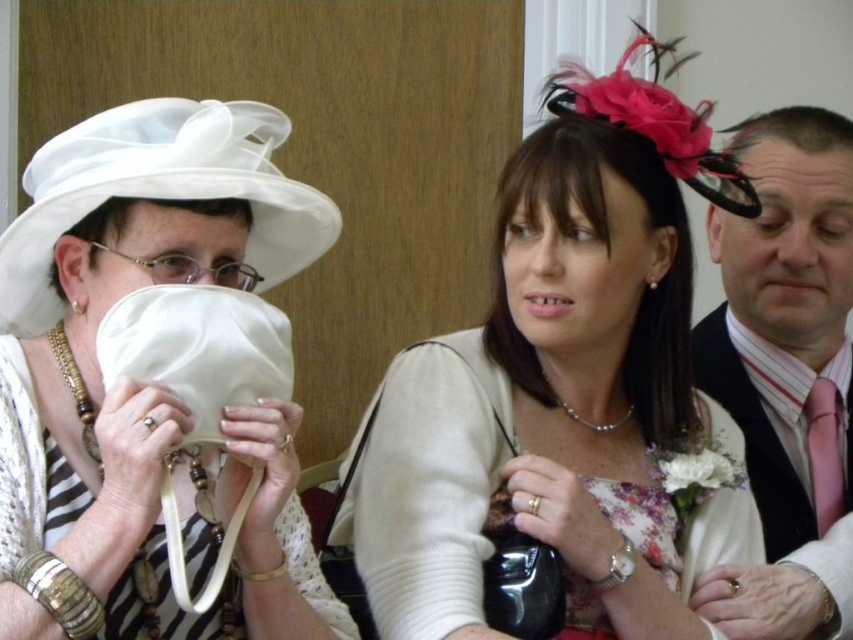
Question: Does matte white hat at left appear on the left side of pink satin tie at right?

Choices:
 (A) no
 (B) yes

Answer: (B)

Question: Which point is closer to the camera?

Choices:
 (A) (293, 536)
 (B) (421, 497)

Answer: (A)

Question: Which object appears farthest from the camera in this image?

Choices:
 (A) pink satin tie at right
 (B) matte white hat at left
 (C) satin floral dress at center

Answer: (A)

Question: Can you confirm if satin floral dress at center is positioned to the right of pink satin tie at right?

Choices:
 (A) no
 (B) yes

Answer: (A)

Question: Which object is the closest to the pink satin tie at right?

Choices:
 (A) satin floral dress at center
 (B) matte white hat at left

Answer: (A)

Question: From the image, what is the correct spatial relationship of satin floral dress at center in relation to pink satin tie at right?

Choices:
 (A) left
 (B) right

Answer: (A)